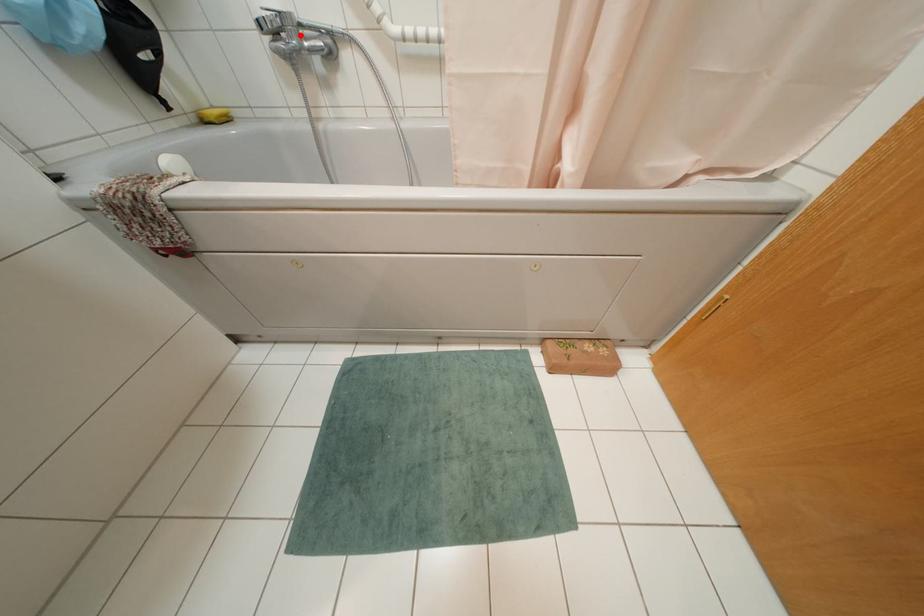
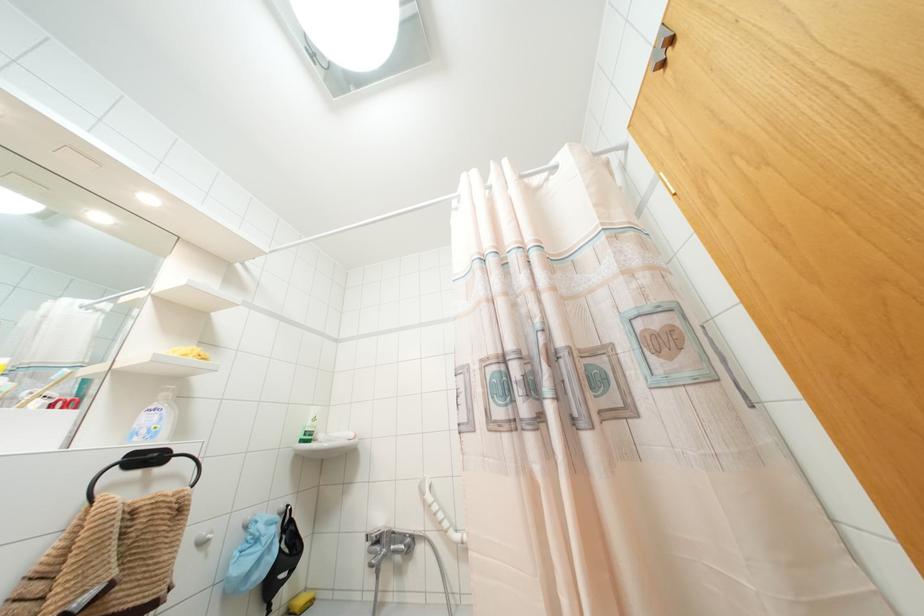
Find the pixel in the second image that matches the highlighted location in the first image.

(390, 541)